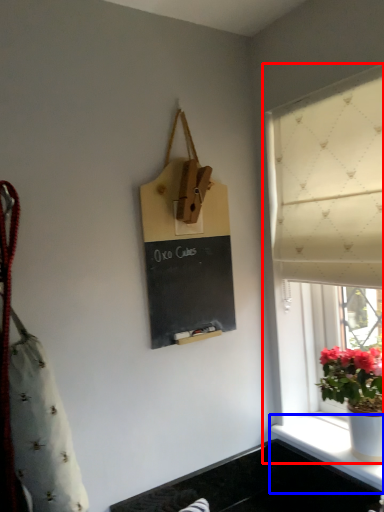
Question: Among these objects, which one is nearest to the camera, window (highlighted by a red box) or window sill (highlighted by a blue box)?

Choices:
 (A) window
 (B) window sill

Answer: (A)